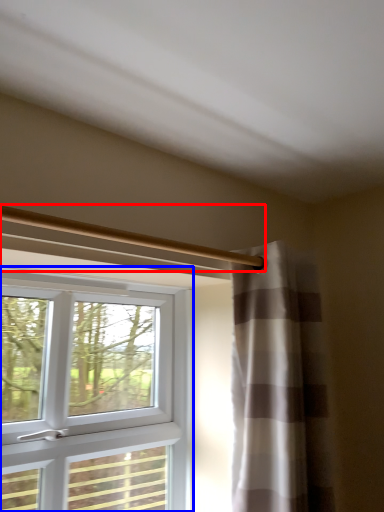
Question: Among these objects, which one is nearest to the camera, beam (highlighted by a red box) or window (highlighted by a blue box)?

Choices:
 (A) beam
 (B) window

Answer: (A)